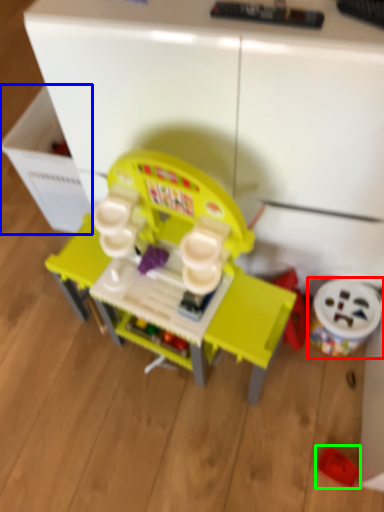
Question: Estimate the real-world distances between objects in this image. Which object is closer to toy (highlighted by a red box), drawer (highlighted by a blue box) or toy (highlighted by a green box)?

Choices:
 (A) drawer
 (B) toy

Answer: (B)